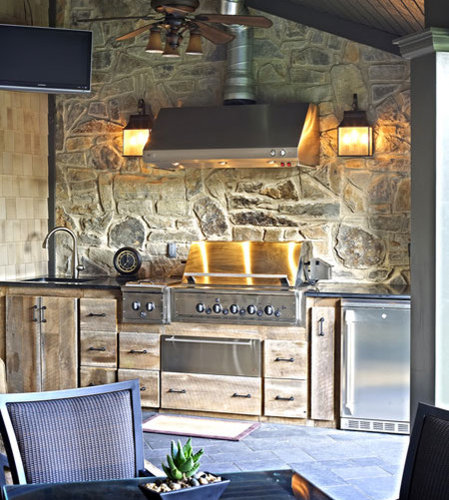
The height and width of the screenshot is (500, 449). In order to click on lanterns in this screenshot , I will do `click(354, 147)`, `click(131, 145)`.